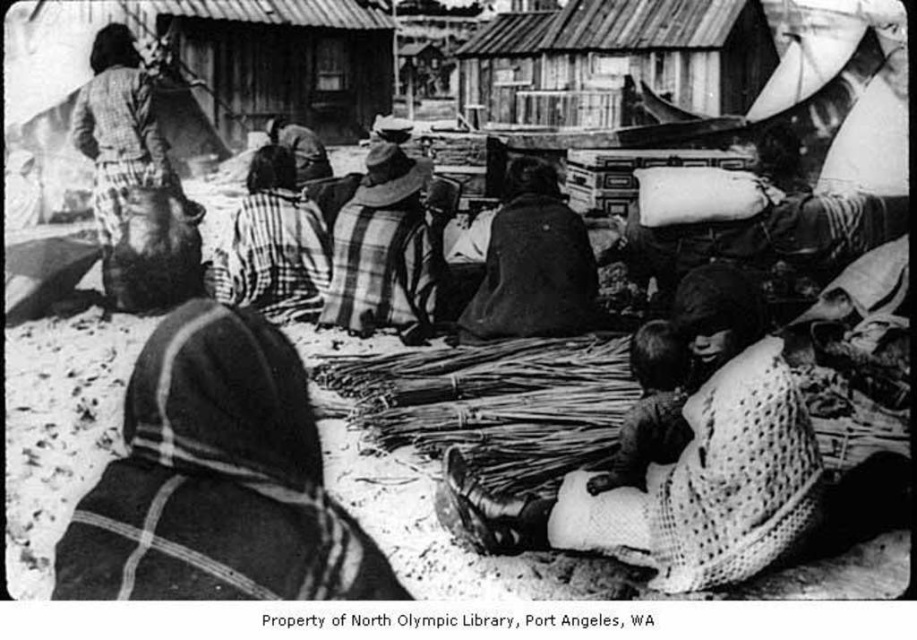
Is wooden hut at upper center positioned before plaid fabric at center?

That is False.

Is wooden hut at upper center taller than plaid fabric at center?

No.

Does point (656, 80) lie behind point (428, 282)?

Yes, it is.

Find the location of a particular element. The width and height of the screenshot is (917, 640). wooden hut at upper center is located at coordinates (613, 60).

What do you see at coordinates (493, 403) in the screenshot? This screenshot has width=917, height=640. I see `smooth straw bundles at center` at bounding box center [493, 403].

Does smooth straw bundles at center have a lesser height compared to striped fabric shawl at center?

Indeed, smooth straw bundles at center has a lesser height compared to striped fabric shawl at center.

Who is more distant from viewer, (570, 365) or (307, 276)?

The point (307, 276) is more distant.

This screenshot has height=640, width=917. What are the coordinates of `smooth straw bundles at center` in the screenshot? It's located at [x=493, y=403].

Image resolution: width=917 pixels, height=640 pixels. Describe the element at coordinates (493, 403) in the screenshot. I see `smooth straw bundles at center` at that location.

Is smooth straw bundles at center to the left of plaid fabric shirt at upper left from the viewer's perspective?

Incorrect, smooth straw bundles at center is not on the left side of plaid fabric shirt at upper left.

Measure the distance between smooth straw bundles at center and camera.

A distance of 3.93 meters exists between smooth straw bundles at center and camera.

The height and width of the screenshot is (640, 917). Identify the location of smooth straw bundles at center. (493, 403).